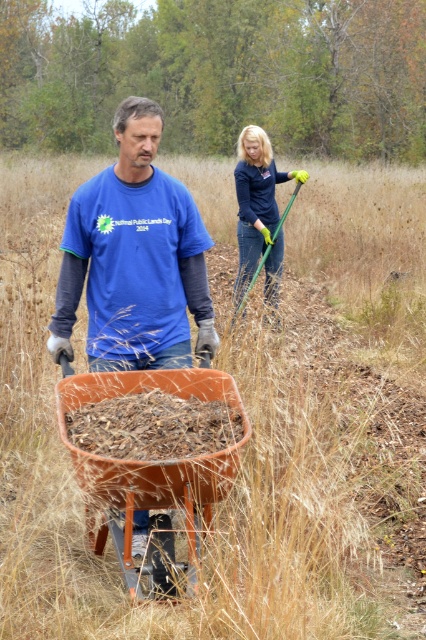
Question: Which object is farther from the camera taking this photo?

Choices:
 (A) matte blue shirt at center
 (B) orange plastic cart at center
 (C) dark blue fabric rake at upper right

Answer: (C)

Question: Is matte blue shirt at center thinner than orange plastic cart at center?

Choices:
 (A) no
 (B) yes

Answer: (A)

Question: Which of the following is the closest to the observer?

Choices:
 (A) (104, 531)
 (B) (250, 176)

Answer: (A)

Question: Does matte blue shirt at center appear over orange plastic cart at center?

Choices:
 (A) no
 (B) yes

Answer: (B)

Question: Is matte blue shirt at center wider than dark blue fabric rake at upper right?

Choices:
 (A) yes
 (B) no

Answer: (A)

Question: Considering the real-world distances, which object is closest to the orange plastic cart at center?

Choices:
 (A) dark blue fabric rake at upper right
 (B) matte blue shirt at center

Answer: (B)